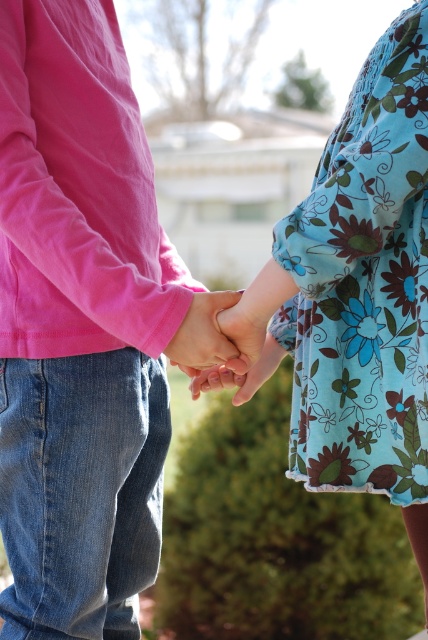
Does floral fabric dress at center have a lesser height compared to matte pink hand at center?

No, floral fabric dress at center is not shorter than matte pink hand at center.

Does floral fabric dress at center appear over matte pink hand at center?

Yes.

Describe the element at coordinates (363, 284) in the screenshot. I see `floral fabric dress at center` at that location.

Locate an element on the screen. floral fabric dress at center is located at coordinates (363, 284).